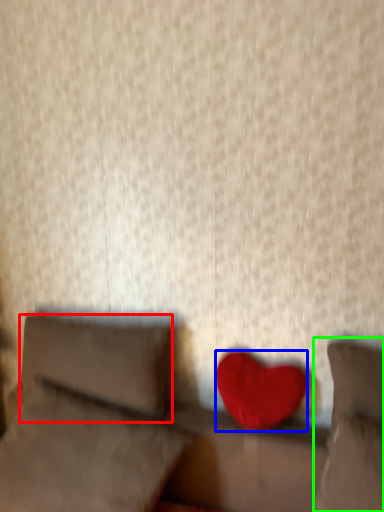
Question: Considering the real-world distances, which object is farthest from pillow (highlighted by a red box)? heart (highlighted by a blue box) or pillow (highlighted by a green box)?

Choices:
 (A) heart
 (B) pillow

Answer: (B)